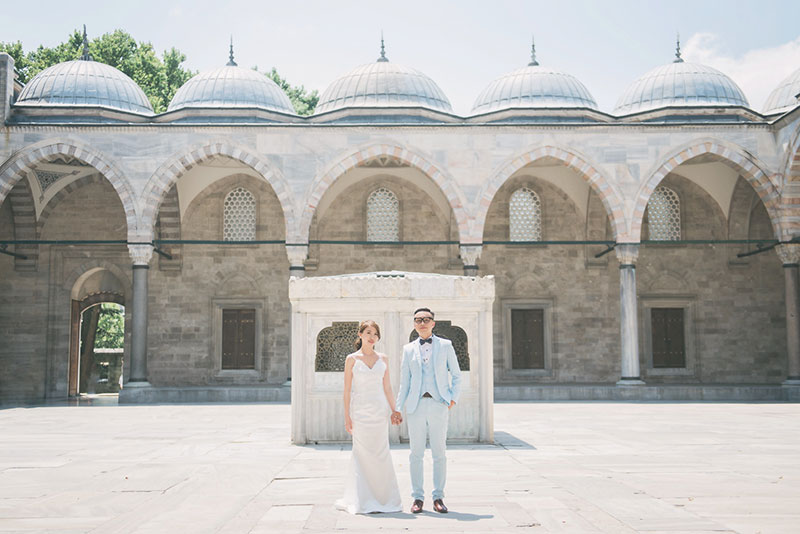
The height and width of the screenshot is (534, 800). I want to click on archway, so click(x=96, y=345).